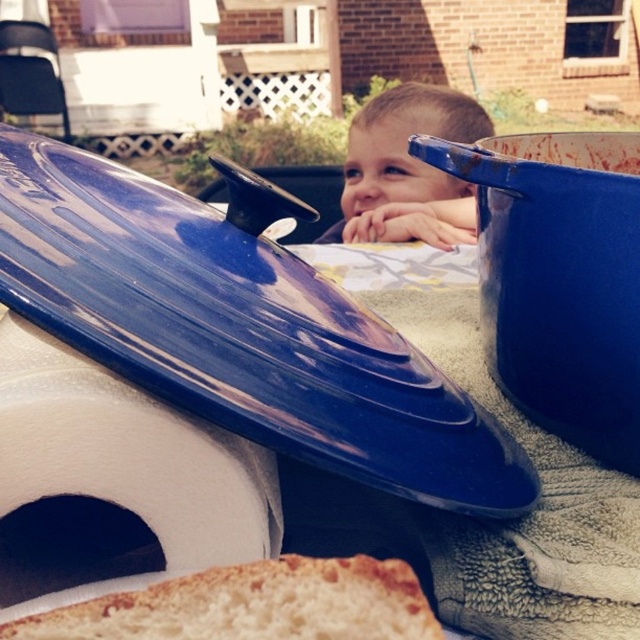
You are a photographer setting up a shot of the golden brown crusty bread at lower center and the smooth skin toddler at center. To ensure both subjects are in focus, you need to know their heights. Which one is shorter?

The golden brown crusty bread at lower center is shorter than the smooth skin toddler at center.

You are a parent trying to ensure your child stays safe while playing in the backyard. You see the white foam toilet paper at lower left and the smooth skin toddler at center. Which object is smaller and needs to be kept away from the toddler to prevent choking?

The white foam toilet paper at lower left is smaller than the smooth skin toddler at center, so it needs to be kept away from the toddler to prevent choking.

You are a parent looking at the backyard scene. You see the white foam toilet paper at lower left and the smooth skin toddler at center. Is the toddler standing on the toilet paper?

The white foam toilet paper at lower left is positioned under smooth skin toddler at center, so yes, the toddler is standing on the toilet paper.